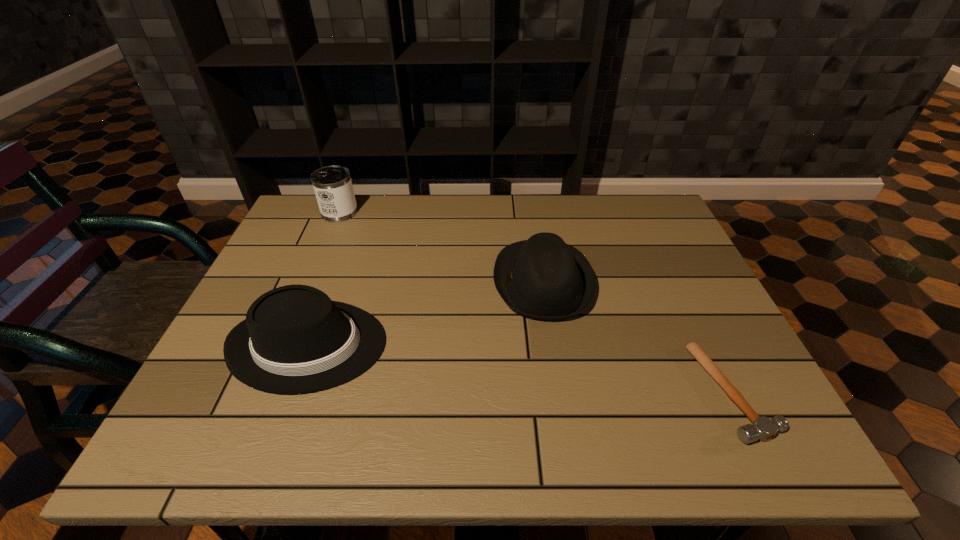
Image resolution: width=960 pixels, height=540 pixels. I want to click on object that ranks as the third closest to the third object from left to right, so click(333, 187).

Point out which object is positioned as the second nearest to the shortest object. Please provide its 2D coordinates. Your answer should be formatted as a tuple, i.e. [(x, y)], where the tuple contains the x and y coordinates of a point satisfying the conditions above.

[(295, 339)]

This screenshot has width=960, height=540. I want to click on free space that satisfies the following two spatial constraints: 1. on the front-facing side of the second object from right to left; 2. on the right side of the rightmost object, so click(561, 392).

This screenshot has width=960, height=540. I want to click on vacant region that satisfies the following two spatial constraints: 1. on the front-facing side of the second object from right to left; 2. on the left side of the shortest object, so click(x=561, y=392).

Image resolution: width=960 pixels, height=540 pixels. Find the location of `free space that satisfies the following two spatial constraints: 1. on the front-facing side of the rightmost object; 2. on the left side of the second object from right to left`. free space that satisfies the following two spatial constraints: 1. on the front-facing side of the rightmost object; 2. on the left side of the second object from right to left is located at coordinates (561, 392).

Locate an element on the screen. Image resolution: width=960 pixels, height=540 pixels. vacant region that satisfies the following two spatial constraints: 1. on the front-facing side of the left fedora; 2. on the back side of the hammer is located at coordinates (291, 392).

Locate an element on the screen. This screenshot has width=960, height=540. blank space that satisfies the following two spatial constraints: 1. on the front-facing side of the rightmost object; 2. on the left side of the right fedora is located at coordinates 561,392.

The image size is (960, 540). I want to click on vacant position in the image that satisfies the following two spatial constraints: 1. on the front-facing side of the hammer; 2. on the left side of the left fedora, so click(291, 392).